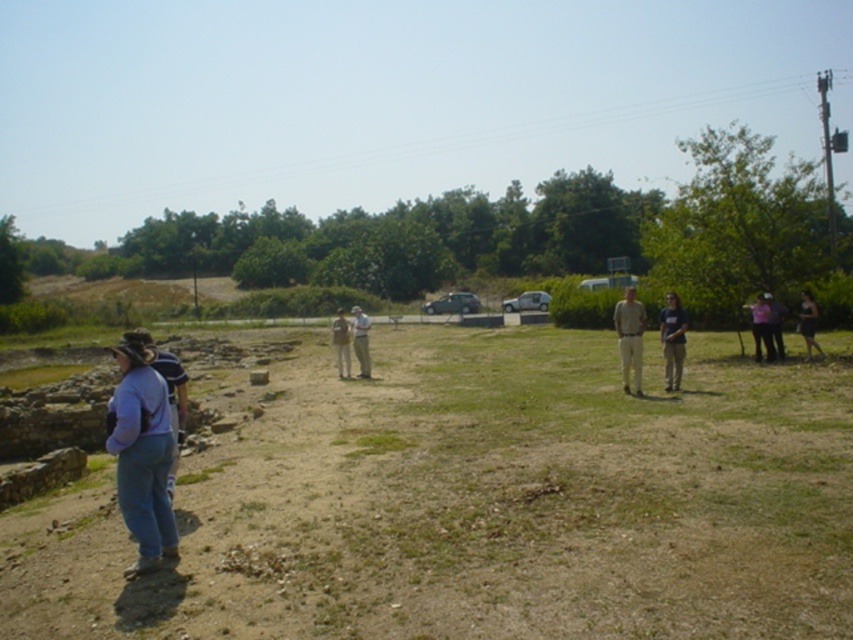
Question: Does blue denim jeans at lower left have a greater width compared to light brown cotton shirt at center?

Choices:
 (A) yes
 (B) no

Answer: (B)

Question: Which point is farther from the camera taking this photo?

Choices:
 (A) (775, 336)
 (B) (672, 330)

Answer: (A)

Question: Can you confirm if purple fabric pants at lower left is positioned above white cotton shirt at center?

Choices:
 (A) no
 (B) yes

Answer: (A)

Question: Where is matte black shirt at center located in relation to white cotton shirt at center in the image?

Choices:
 (A) above
 (B) below

Answer: (B)

Question: Estimate the real-world distances between objects in this image. Which object is closer to the light brown cotton shirt at center?

Choices:
 (A) purple fabric pants at lower left
 (B) light brown leather jacket at center
 (C) brown dirt field at center
 (D) dark brown leather jacket at right

Answer: (C)

Question: Which object is the farthest from the light brown leather jacket at center?

Choices:
 (A) light brown cotton shirt at center
 (B) pink fabric shirt at right
 (C) denim pants at center
 (D) dark brown leather jacket at right

Answer: (D)